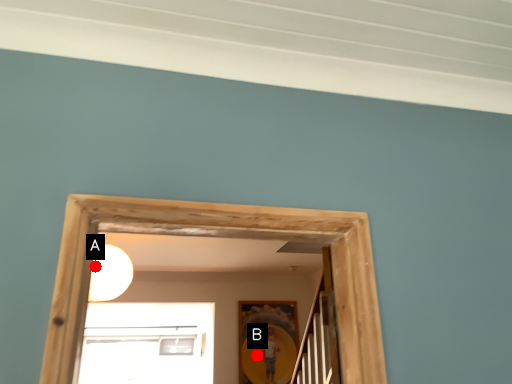
Question: Two points are circled on the image, labeled by A and B beside each circle. Among these points, which one is nearest to the camera?

Choices:
 (A) A is closer
 (B) B is closer

Answer: (A)